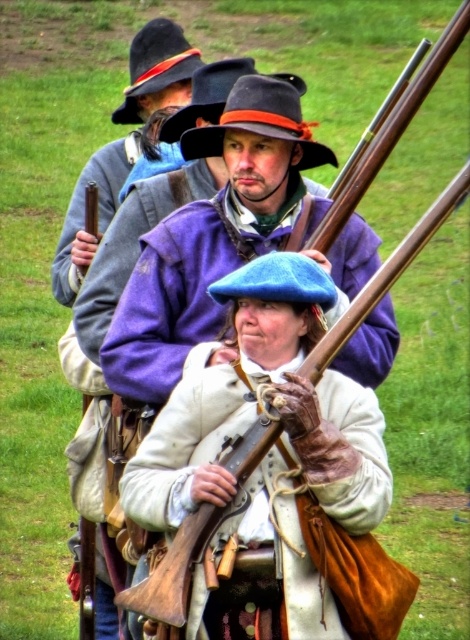
You are a photographer standing in front of the scene. You want to take a photo that includes both the point at coordinates point (363, 227) and point (250, 81). Which point is closer to you, the photographer?

Point (363, 227) is further to the viewer than point (250, 81), so the point at (250, 81) is closer to you.

You are a costume designer observing the historical reenactment scene. You need to determine the position of the blue felt beret at center relative to the blue felt beret at upper center. Which beret is positioned lower in the image?

The blue felt beret at center is located below the blue felt beret at upper center, so the one at center is lower.

You are observing a historical reenactment scene. There is a matte purple coat at center and a blue felt beret at upper center. Which object is positioned closer to you?

The matte purple coat at center is closer to the viewer than the blue felt beret at upper center.